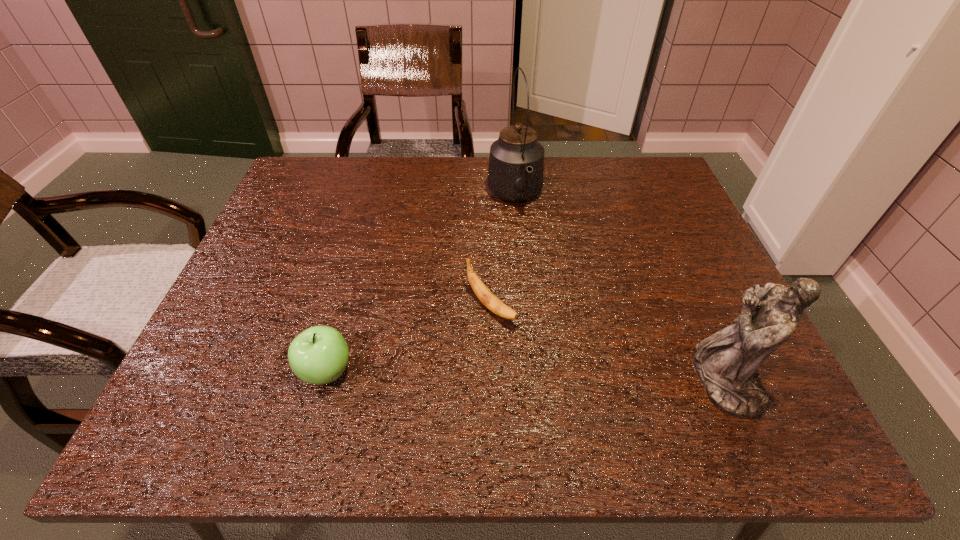
The width and height of the screenshot is (960, 540). I want to click on apple, so click(319, 355).

Locate an element on the screen. the second shortest object is located at coordinates (319, 355).

Where is `the second tallest object`? Image resolution: width=960 pixels, height=540 pixels. the second tallest object is located at coordinates (726, 363).

Where is `the rightmost object`? The height and width of the screenshot is (540, 960). the rightmost object is located at coordinates (726, 363).

Locate an element on the screen. the tallest object is located at coordinates (516, 163).

Locate an element on the screen. the farthest object is located at coordinates (516, 163).

Where is `the shortest object`? the shortest object is located at coordinates (494, 304).

I want to click on banana, so click(x=494, y=304).

In order to click on vacant space located 0.200m on the back of the leftmost object in this screenshot , I will do `click(353, 277)`.

I want to click on free location located on the front-facing side of the third shortest object, so click(544, 380).